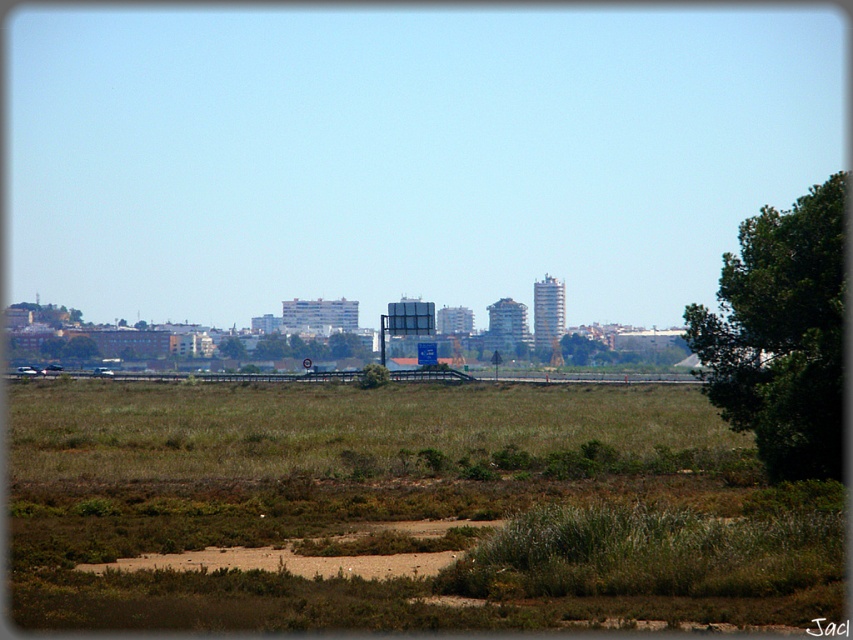
You are standing in the open landscape and want to walk towards the city in the background. Which object, the brown dry grass at lower center or the green leafy tree at right, would you pass closer to first?

The brown dry grass at lower center is in front of the green leafy tree at right, so you would pass closer to the brown dry grass at lower center first before reaching the city.

You are standing at the edge of the grassy area and want to walk towards the city in the background. Which object will you encounter first, the brown dry grass at lower center or the green leafy tree at center?

The brown dry grass at lower center is in front of the green leafy tree at center, so you will encounter the brown dry grass at lower center first when walking towards the city.

You are standing at point [403,509] in the image. What do you see immediately around you?

You see brown dry grass at lower center immediately around you.